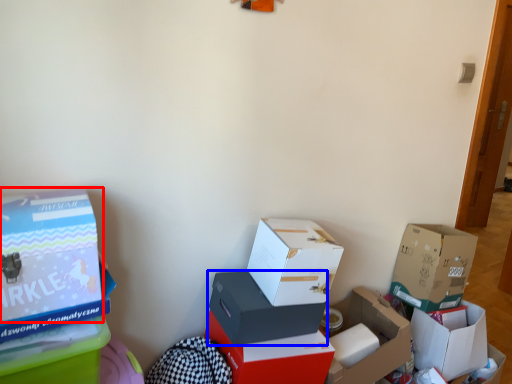
Question: Which point is closer to the camera, box (highlighted by a red box) or box (highlighted by a blue box)?

Choices:
 (A) box
 (B) box

Answer: (A)